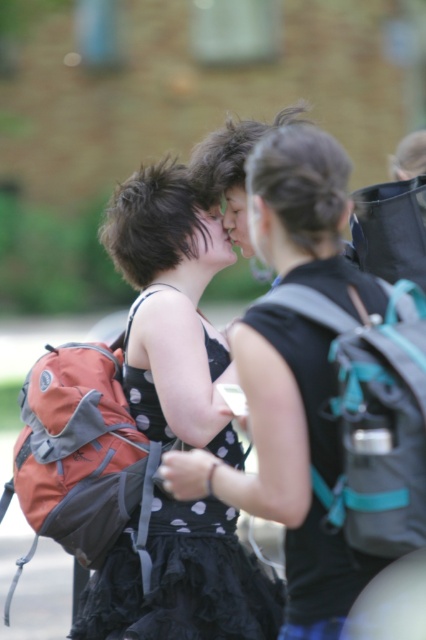
Does matte black backpack at center have a larger size compared to teal fabric backpack at center?

Correct, matte black backpack at center is larger in size than teal fabric backpack at center.

Is matte black backpack at center further to camera compared to teal fabric backpack at center?

No, matte black backpack at center is in front of teal fabric backpack at center.

The image size is (426, 640). Identify the location of matte black backpack at center. (313, 390).

At what (x,y) coordinates should I click in order to perform the action: click on matte black backpack at center. Please return your answer as a coordinate pair (x, y). This screenshot has height=640, width=426. Looking at the image, I should click on (313, 390).

Is matte black backpack at center closer to the viewer compared to black dotted fabric dress at center?

That is True.

Does point (262, 349) come closer to viewer compared to point (255, 595)?

Yes, point (262, 349) is in front of point (255, 595).

Measure the distance between point (290, 602) and camera.

Point (290, 602) and camera are 3.96 meters apart from each other.

Locate an element on the screen. The height and width of the screenshot is (640, 426). matte black backpack at center is located at coordinates (313, 390).

Between teal fabric backpack at center and black dotted fabric dress at center, which one has more height?

black dotted fabric dress at center is taller.

Does teal fabric backpack at center have a greater height compared to black dotted fabric dress at center?

No, teal fabric backpack at center is not taller than black dotted fabric dress at center.

Is point (305, 298) more distant than point (152, 385)?

No, (305, 298) is in front of (152, 385).

Identify the location of teal fabric backpack at center. The height and width of the screenshot is (640, 426). (373, 416).